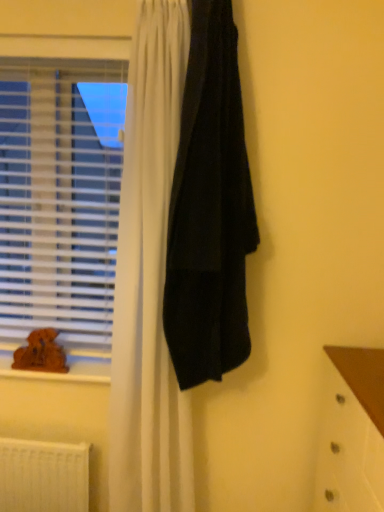
Question: Should I look upward or downward to see white plastic radiator at lower left?

Choices:
 (A) up
 (B) down

Answer: (B)

Question: From the image's perspective, would you say brown plush toy at lower left is shown under white plastic radiator at lower left?

Choices:
 (A) no
 (B) yes

Answer: (A)

Question: From the image's perspective, is brown plush toy at lower left above white plastic radiator at lower left?

Choices:
 (A) yes
 (B) no

Answer: (A)

Question: Is brown plush toy at lower left positioned far away from white plastic radiator at lower left?

Choices:
 (A) no
 (B) yes

Answer: (A)

Question: Is brown plush toy at lower left positioned beyond the bounds of white plastic radiator at lower left?

Choices:
 (A) no
 (B) yes

Answer: (B)

Question: From a real-world perspective, is brown plush toy at lower left positioned under white plastic radiator at lower left based on gravity?

Choices:
 (A) no
 (B) yes

Answer: (A)

Question: Is brown plush toy at lower left directly adjacent to white plastic radiator at lower left?

Choices:
 (A) yes
 (B) no

Answer: (B)

Question: From the image's perspective, is white plastic radiator at lower left on top of brown plush toy at lower left?

Choices:
 (A) yes
 (B) no

Answer: (B)

Question: Does white plastic radiator at lower left appear on the left side of brown plush toy at lower left?

Choices:
 (A) yes
 (B) no

Answer: (B)

Question: Considering the relative sizes of white plastic radiator at lower left and brown plush toy at lower left in the image provided, is white plastic radiator at lower left taller than brown plush toy at lower left?

Choices:
 (A) yes
 (B) no

Answer: (A)

Question: Considering the relative sizes of white plastic radiator at lower left and brown plush toy at lower left in the image provided, is white plastic radiator at lower left wider than brown plush toy at lower left?

Choices:
 (A) yes
 (B) no

Answer: (A)

Question: Can you confirm if white plastic radiator at lower left is positioned to the right of brown plush toy at lower left?

Choices:
 (A) no
 (B) yes

Answer: (B)

Question: Is white plastic radiator at lower left smaller than brown plush toy at lower left?

Choices:
 (A) yes
 (B) no

Answer: (B)

Question: Does brown plush toy at lower left have a lesser width compared to black matte towel at center?

Choices:
 (A) yes
 (B) no

Answer: (A)